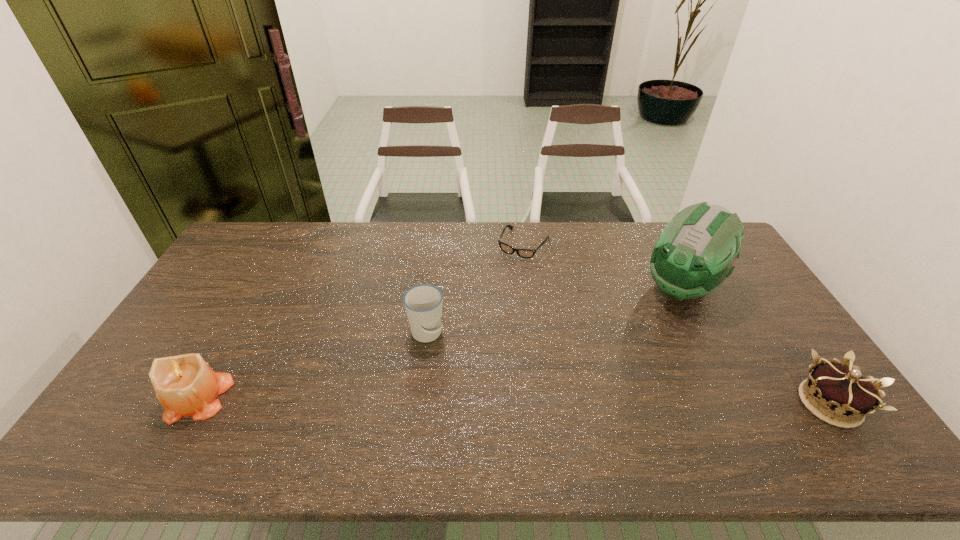
This screenshot has height=540, width=960. Identify the location of unoccupied area between the third nearest object and the football helmet. (554, 310).

At what (x,y) coordinates should I click in order to perform the action: click on empty space between the spectacles and the third farthest object. Please return your answer as a coordinate pair (x, y). Image resolution: width=960 pixels, height=540 pixels. Looking at the image, I should click on (475, 289).

Image resolution: width=960 pixels, height=540 pixels. Find the location of `vacant point located between the second object from left to right and the football helmet`. vacant point located between the second object from left to right and the football helmet is located at coordinates (554, 310).

Where is `object identified as the third closest to the crown`? This screenshot has height=540, width=960. object identified as the third closest to the crown is located at coordinates (423, 303).

You are a GUI agent. You are given a task and a screenshot of the screen. Output one action in this format:
    pyautogui.click(x=<x>, y=<y>)
    Task: Click on the object that is the fourth closest to the crown
    The height and width of the screenshot is (540, 960).
    Given the screenshot: What is the action you would take?
    (x=185, y=385)

Where is `vacant region that satisfies the following two spatial constraints: 1. on the front side of the football helmet; 2. on the left side of the shortest object`? The width and height of the screenshot is (960, 540). vacant region that satisfies the following two spatial constraints: 1. on the front side of the football helmet; 2. on the left side of the shortest object is located at coordinates (529, 287).

At what (x,y) coordinates should I click in order to perform the action: click on vacant area that satisfies the following two spatial constraints: 1. on the back side of the candle; 2. on the right side of the football helmet. Please return your answer as a coordinate pair (x, y). The width and height of the screenshot is (960, 540). Looking at the image, I should click on (261, 287).

What are the coordinates of `vacant position in the image that satisfies the following two spatial constraints: 1. on the front side of the crown; 2. on the right side of the spectacles` in the screenshot? It's located at (543, 403).